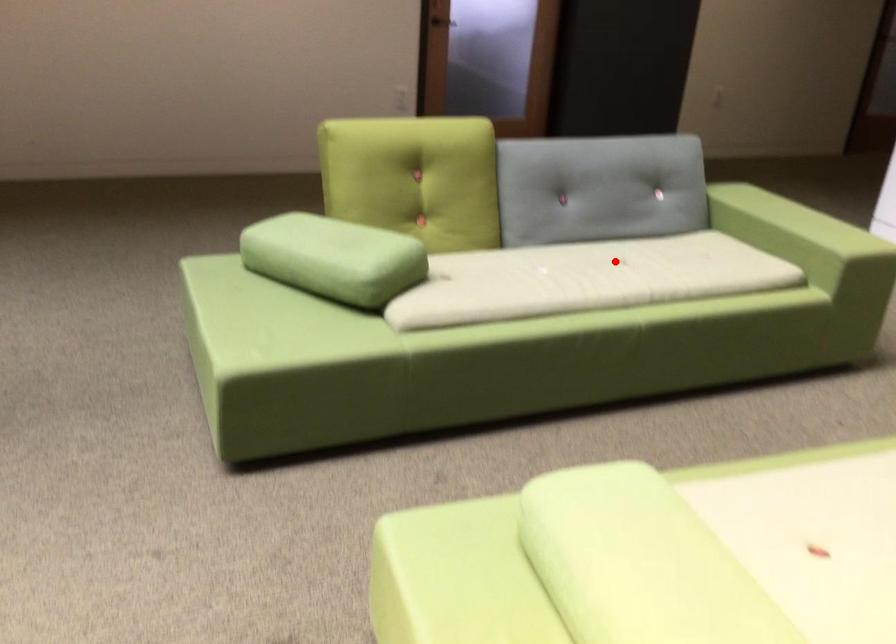
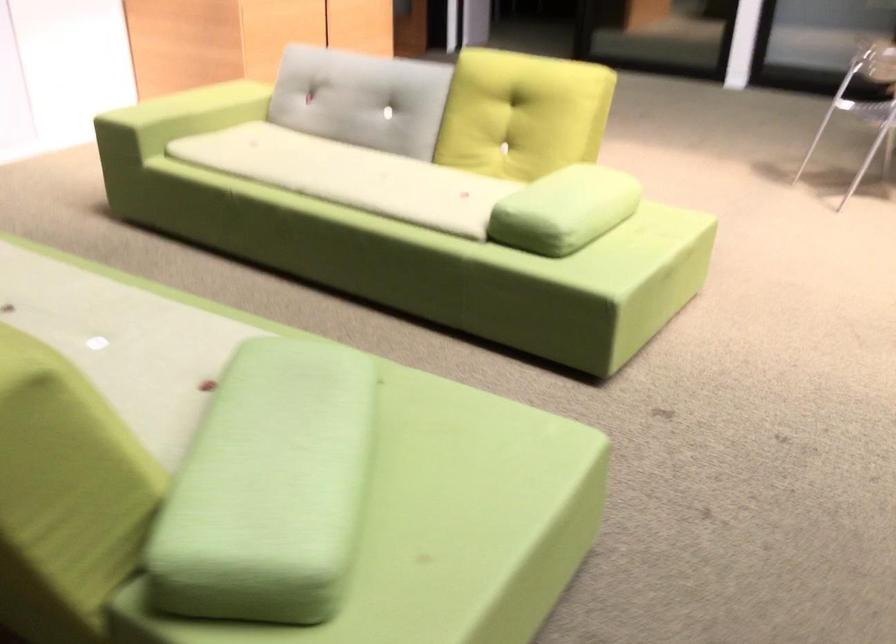
Question: I am providing you with two images of the same scene from different viewpoints. A red point is shown in image1. For the corresponding object point in image2, is it positioned nearer or farther from the camera?

Choices:
 (A) Nearer
 (B) Farther

Answer: (A)